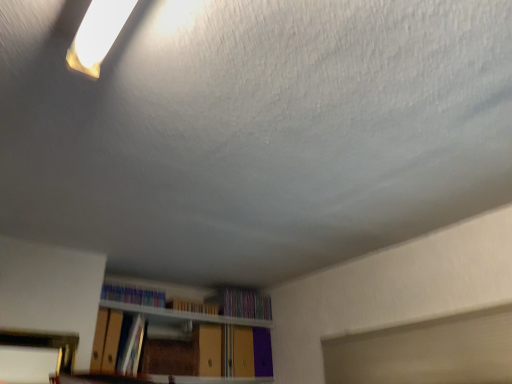
Question: Is multicolored paper at center, marked as the 1th book in a right-to-left arrangement, outside hardcover book at center, the second book from the right?

Choices:
 (A) no
 (B) yes

Answer: (B)

Question: From the image's perspective, is multicolored paper at center, which appears as the fourth book when viewed from the left, located beneath hardcover book at center, which is the 3th book from left to right?

Choices:
 (A) yes
 (B) no

Answer: (A)

Question: Is the position of multicolored paper at center, marked as the 1th book in a right-to-left arrangement, less distant than that of hardcover book at center, the second book from the right?

Choices:
 (A) no
 (B) yes

Answer: (A)

Question: Is multicolored paper at center, marked as the 1th book in a right-to-left arrangement, positioned far away from hardcover book at center, which is the 3th book from left to right?

Choices:
 (A) yes
 (B) no

Answer: (B)

Question: Is multicolored paper at center, which appears as the fourth book when viewed from the left, to the right of hardcover book at center, which is the 3th book from left to right, from the viewer's perspective?

Choices:
 (A) yes
 (B) no

Answer: (A)

Question: From the image's perspective, is multicolored paper at center, marked as the 1th book in a right-to-left arrangement, above or below hardcover book at center, the second book from the right?

Choices:
 (A) above
 (B) below

Answer: (B)

Question: Does point (224, 309) appear closer or farther from the camera than point (197, 302)?

Choices:
 (A) farther
 (B) closer

Answer: (A)

Question: From a real-world perspective, is multicolored paper at center, which appears as the fourth book when viewed from the left, physically located above or below hardcover book at center, the second book from the right?

Choices:
 (A) above
 (B) below

Answer: (A)

Question: Relative to hardcover book at center, the second book from the right, is multicolored paper at center, which appears as the fourth book when viewed from the left, in front or behind?

Choices:
 (A) behind
 (B) front

Answer: (A)

Question: In the image, is hardcover book at center, which is the 3th book from left to right, on the left side or the right side of hardcover book at center, which is the second book from left to right?

Choices:
 (A) right
 (B) left

Answer: (A)

Question: Relative to hardcover book at center, which ranks as the 3th book in right-to-left order, is hardcover book at center, the second book from the right, in front or behind?

Choices:
 (A) behind
 (B) front

Answer: (A)

Question: From a real-world perspective, is hardcover book at center, which is the 3th book from left to right, positioned above or below hardcover book at center, which ranks as the 3th book in right-to-left order?

Choices:
 (A) above
 (B) below

Answer: (A)

Question: Is hardcover book at center, which is the 3th book from left to right, inside the boundaries of hardcover book at center, which ranks as the 3th book in right-to-left order, or outside?

Choices:
 (A) outside
 (B) inside

Answer: (A)

Question: From a real-world perspective, is hardcover book at center, which ranks as the 3th book in right-to-left order, positioned above or below multicolored plastic books at upper center, which appears as the fourth book when viewed from the right?

Choices:
 (A) above
 (B) below

Answer: (B)

Question: Considering the positions of hardcover book at center, which ranks as the 3th book in right-to-left order, and multicolored plastic books at upper center, which appears as the fourth book when viewed from the right, in the image, is hardcover book at center, which ranks as the 3th book in right-to-left order, taller or shorter than multicolored plastic books at upper center, which appears as the fourth book when viewed from the right,?

Choices:
 (A) tall
 (B) short

Answer: (A)